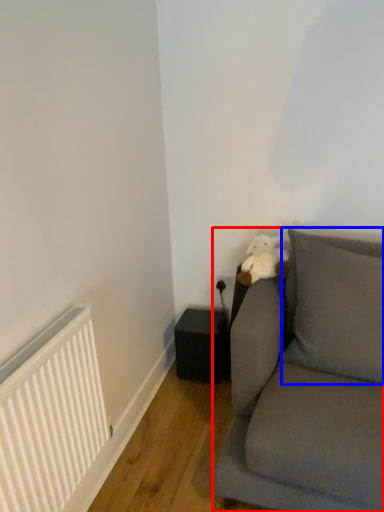
Question: Which point is further to the camera, studio couch (highlighted by a red box) or pillow (highlighted by a blue box)?

Choices:
 (A) studio couch
 (B) pillow

Answer: (B)